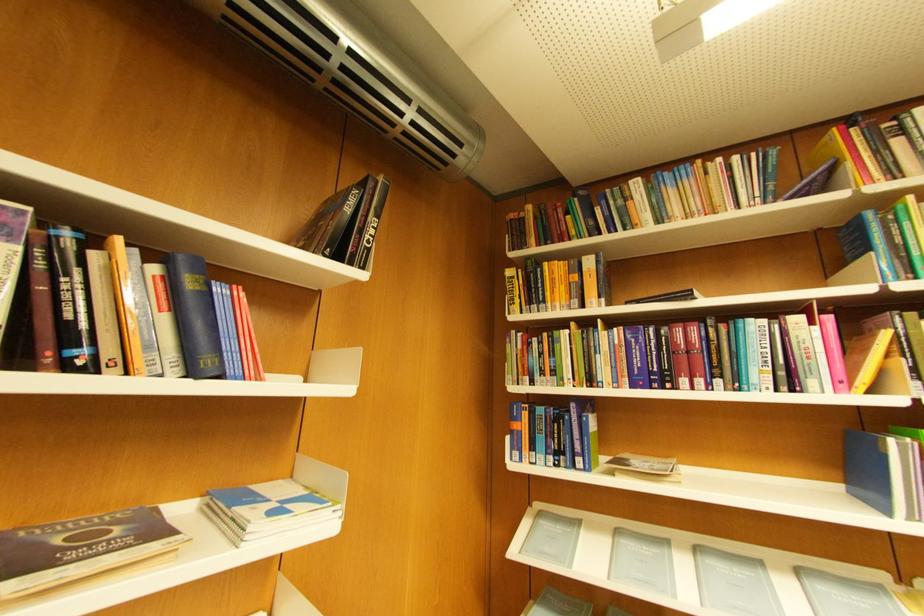
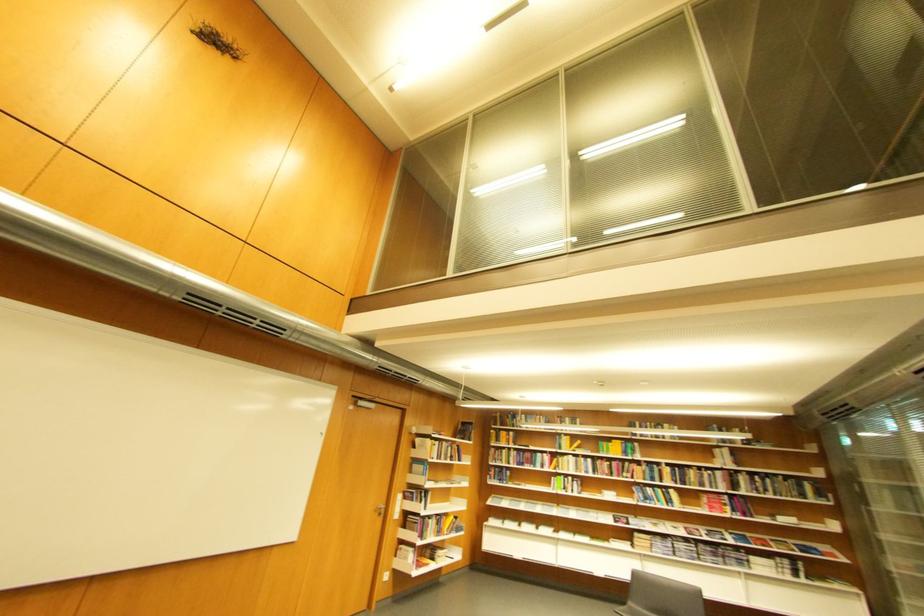
In the second image, find the point that corresponds to the point at 28,362 in the first image.

(460, 461)